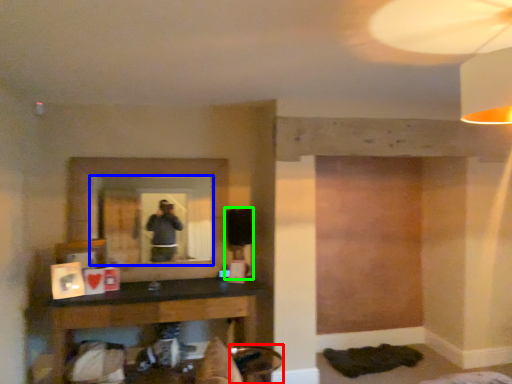
Question: Which object is positioned farthest from swivel chair (highlighted by a red box)? Select from mirror (highlighted by a blue box) and table lamp (highlighted by a green box).

Choices:
 (A) mirror
 (B) table lamp

Answer: (A)